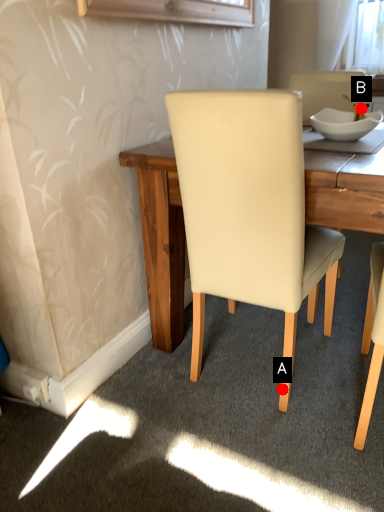
Question: Two points are circled on the image, labeled by A and B beside each circle. Among these points, which one is farthest from the camera?

Choices:
 (A) A is further
 (B) B is further

Answer: (B)